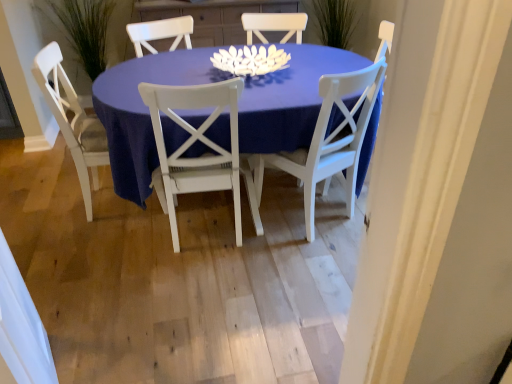
Question: From the image's perspective, is white painted wood chair at center, the 1th chair in the right-to-left sequence, positioned above or below white wood chair at left, which is counted as the third chair, starting from the right?

Choices:
 (A) above
 (B) below

Answer: (B)

Question: Does point (326, 100) appear closer or farther from the camera than point (49, 105)?

Choices:
 (A) closer
 (B) farther

Answer: (A)

Question: Estimate the real-world distances between objects in this image. Which object is farther from the white painted wood chair at center, positioned as the third chair in left-to-right order?

Choices:
 (A) matte white table at center
 (B) green grass at left
 (C) white wood chair at center, placed as the second chair when sorted from left to right
 (D) white wood chair at left, which is counted as the third chair, starting from the right

Answer: (B)

Question: Which of these objects is positioned closest to the white painted wood chair at center, the 1th chair in the right-to-left sequence?

Choices:
 (A) green grass at left
 (B) matte white table at center
 (C) white wood chair at left, which is counted as the third chair, starting from the right
 (D) white wood chair at center, positioned as the 2th chair in right-to-left order

Answer: (B)